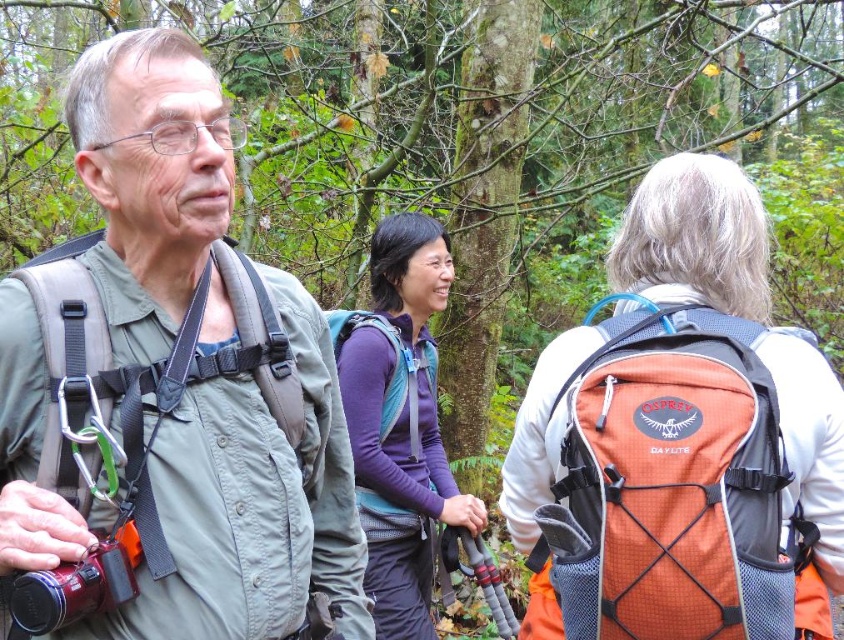
Question: Can you confirm if matte green jacket at center is positioned below purple fleece jacket at center?

Choices:
 (A) no
 (B) yes

Answer: (A)

Question: Can you confirm if orange mesh backpack at upper right is positioned to the left of teal mesh backpack at center?

Choices:
 (A) yes
 (B) no

Answer: (B)

Question: Among these objects, which one is farthest from the camera?

Choices:
 (A) orange mesh backpack at upper right
 (B) matte green jacket at center
 (C) purple fleece jacket at center

Answer: (C)

Question: Which of the following is the closest to the observer?

Choices:
 (A) (401, 252)
 (B) (133, 566)
 (C) (349, 317)
 (D) (565, 563)

Answer: (B)

Question: Among these objects, which one is nearest to the camera?

Choices:
 (A) purple fleece jacket at center
 (B) matte green jacket at center
 (C) orange mesh backpack at upper right
 (D) teal mesh backpack at center

Answer: (B)

Question: Is matte green jacket at center behind purple fleece jacket at center?

Choices:
 (A) no
 (B) yes

Answer: (A)